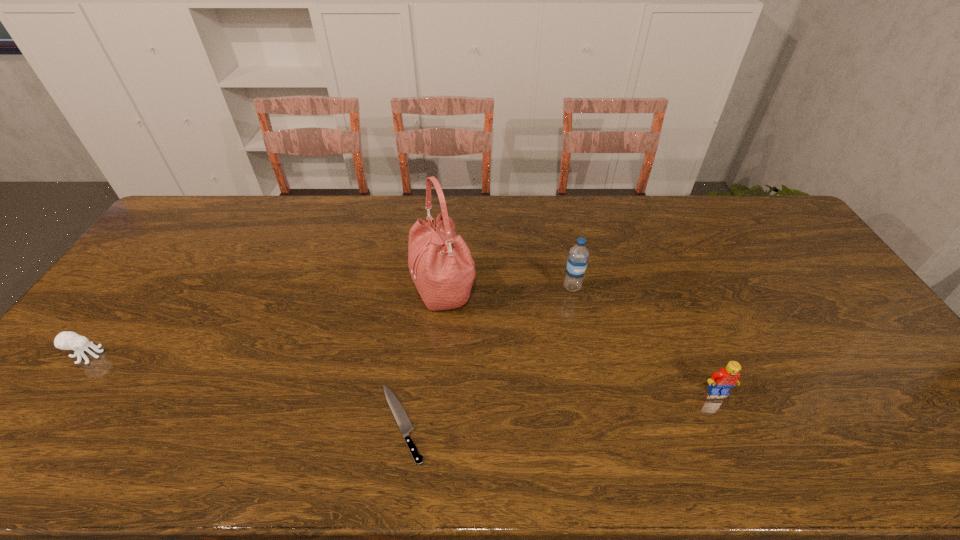
Identify the location of vacant area situated on the face of the rightmost object. (740, 443).

You are a GUI agent. You are given a task and a screenshot of the screen. Output one action in this format:
    pyautogui.click(x=<x>, y=<y>)
    Task: Click on the vacant space located on the front-facing side of the leftmost object
    Image resolution: width=960 pixels, height=540 pixels.
    Given the screenshot: What is the action you would take?
    pyautogui.click(x=189, y=355)

Where is `vacant space located on the left of the steak knife`? The height and width of the screenshot is (540, 960). vacant space located on the left of the steak knife is located at coordinates (224, 423).

Where is `object present at the near edge`? The height and width of the screenshot is (540, 960). object present at the near edge is located at coordinates (402, 419).

The width and height of the screenshot is (960, 540). In order to click on object at the left edge in this screenshot , I will do `click(67, 340)`.

In the image, there is a desktop. At what (x,y) coordinates should I click in order to perform the action: click on vacant space at the far edge. Please return your answer as a coordinate pair (x, y). The width and height of the screenshot is (960, 540). Looking at the image, I should click on (555, 200).

Identify the location of free space at the near edge of the desktop. (334, 455).

Where is `vacant area at the left edge of the desktop`? vacant area at the left edge of the desktop is located at coordinates (173, 244).

The image size is (960, 540). In order to click on vacant space at the far left corner of the desktop in this screenshot , I will do `click(211, 231)`.

Where is `free space between the water bottle and the rightmost object`? The width and height of the screenshot is (960, 540). free space between the water bottle and the rightmost object is located at coordinates (645, 339).